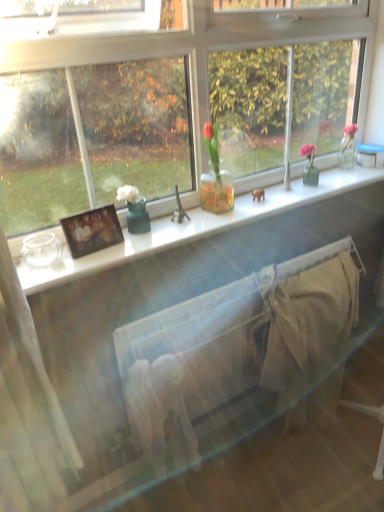
This screenshot has width=384, height=512. In order to click on vacant point above white glossy window sill at center (from a real-world perspective) in this screenshot , I will do `click(216, 212)`.